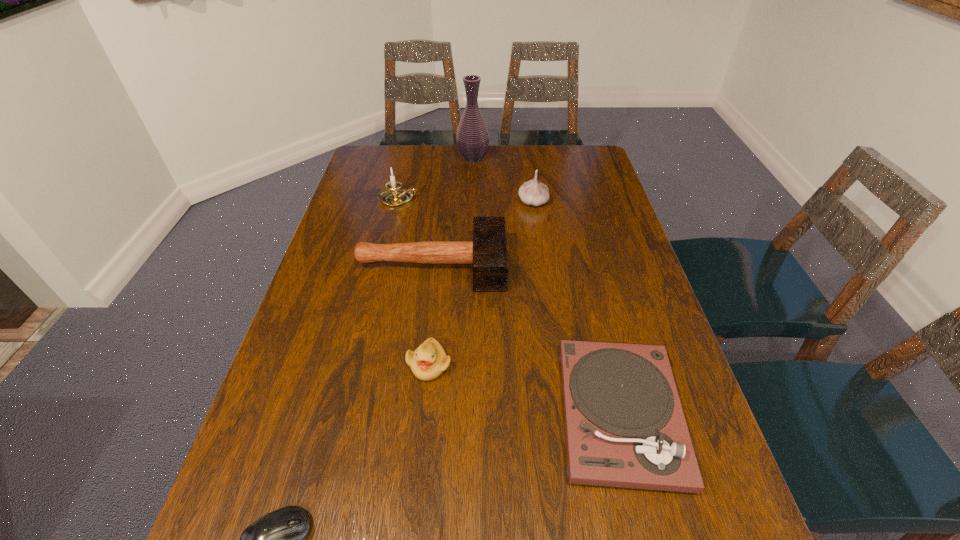
I want to click on free region at the far right corner of the desktop, so click(x=598, y=155).

Identify the location of vacant space in between the candle holder and the phonograph_record. The width and height of the screenshot is (960, 540). (509, 306).

In order to click on free area in between the mallet and the duckling in this screenshot , I will do `click(430, 315)`.

Identify the location of unoccupied area between the fourth nearest object and the phonograph_record. (526, 339).

The width and height of the screenshot is (960, 540). Identify the location of free area in between the fourth farthest object and the duckling. (430, 315).

Image resolution: width=960 pixels, height=540 pixels. What are the coordinates of `free space between the phonograph_record and the garlic` in the screenshot? It's located at (576, 308).

Locate an element on the screen. free space between the phonograph_record and the candle holder is located at coordinates (509, 306).

Identify the location of the closest object to the farthest object. (x=393, y=196).

Identify the location of object that stands as the fifth closest to the fourth nearest object. This screenshot has height=540, width=960. (472, 138).

The image size is (960, 540). I want to click on free space that satisfies the following two spatial constraints: 1. on the front-facing side of the phonograph_record; 2. on the right side of the duckling, so click(x=424, y=414).